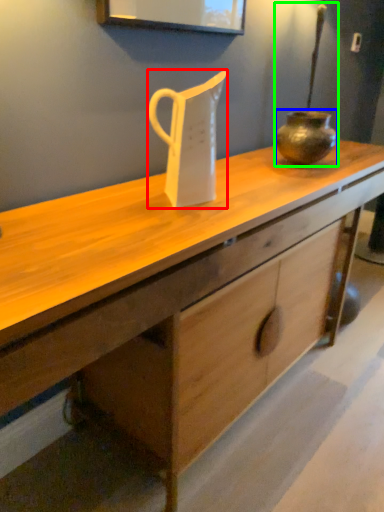
Question: Which object is the farthest from jug (highlighted by a red box)? Choose among these: vase (highlighted by a blue box) or candle holder (highlighted by a green box).

Choices:
 (A) vase
 (B) candle holder

Answer: (B)